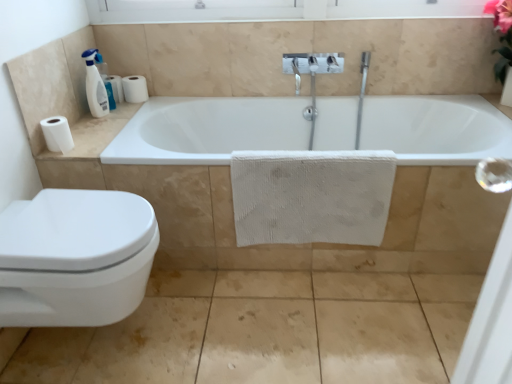
Question: Is the surface of white matte toilet paper at left, the third toilet paper in the bottom-to-top sequence, in direct contact with white matte toilet paper at left, which is counted as the first toilet paper, starting from the front?

Choices:
 (A) no
 (B) yes

Answer: (A)

Question: Does white matte toilet paper at left, positioned as the third toilet paper in front-to-back order, appear on the left side of white matte toilet paper at left, which appears as the third toilet paper when viewed from the top?

Choices:
 (A) no
 (B) yes

Answer: (A)

Question: From a real-world perspective, is white matte toilet paper at left, positioned as the third toilet paper in front-to-back order, physically below white matte toilet paper at left, the first toilet paper ordered from the bottom?

Choices:
 (A) yes
 (B) no

Answer: (B)

Question: Can you confirm if white matte toilet paper at left, positioned as the third toilet paper in front-to-back order, is smaller than white matte toilet paper at left, the first toilet paper ordered from the bottom?

Choices:
 (A) no
 (B) yes

Answer: (B)

Question: Does white matte toilet paper at left, the 1th toilet paper from the top, appear on the right side of white matte toilet paper at left, which is counted as the first toilet paper, starting from the front?

Choices:
 (A) yes
 (B) no

Answer: (A)

Question: Is white matte toilet paper at left, the 1th toilet paper from the back, facing away from white matte toilet paper at left, which is counted as the first toilet paper, starting from the front?

Choices:
 (A) yes
 (B) no

Answer: (B)

Question: Is white textured towel at center positioned behind white matte toilet paper at upper left, the 2th toilet paper ordered from the bottom?

Choices:
 (A) no
 (B) yes

Answer: (A)

Question: Considering the relative sizes of white textured towel at center and white matte toilet paper at upper left, arranged as the 2th toilet paper when viewed from the front, in the image provided, is white textured towel at center wider than white matte toilet paper at upper left, arranged as the 2th toilet paper when viewed from the front,?

Choices:
 (A) no
 (B) yes

Answer: (A)

Question: From a real-world perspective, does white textured towel at center sit lower than white matte toilet paper at upper left, the 2th toilet paper ordered from the bottom?

Choices:
 (A) no
 (B) yes

Answer: (B)

Question: Are white textured towel at center and white matte toilet paper at upper left, acting as the 2th toilet paper starting from the back, located far from each other?

Choices:
 (A) no
 (B) yes

Answer: (B)

Question: From a real-world perspective, is white textured towel at center over white matte toilet paper at upper left, acting as the 2th toilet paper starting from the back?

Choices:
 (A) yes
 (B) no

Answer: (B)

Question: Is white textured towel at center located outside white matte toilet paper at upper left, marked as the 2th toilet paper in a top-to-bottom arrangement?

Choices:
 (A) yes
 (B) no

Answer: (A)

Question: Is white glossy bathtub at center thinner than matte beige tile at lower left?

Choices:
 (A) no
 (B) yes

Answer: (A)